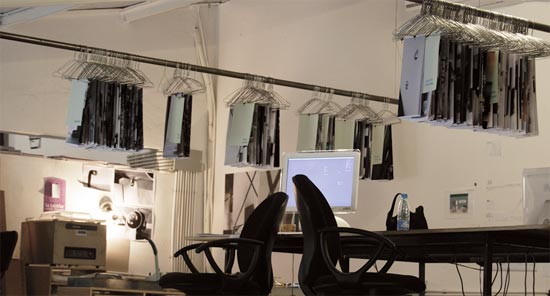
I want to click on wall, so click(329, 55).